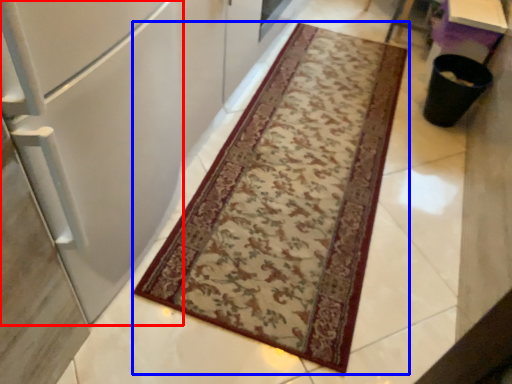
Question: Among these objects, which one is nearest to the camera, fridge (highlighted by a red box) or mat (highlighted by a blue box)?

Choices:
 (A) fridge
 (B) mat

Answer: (A)